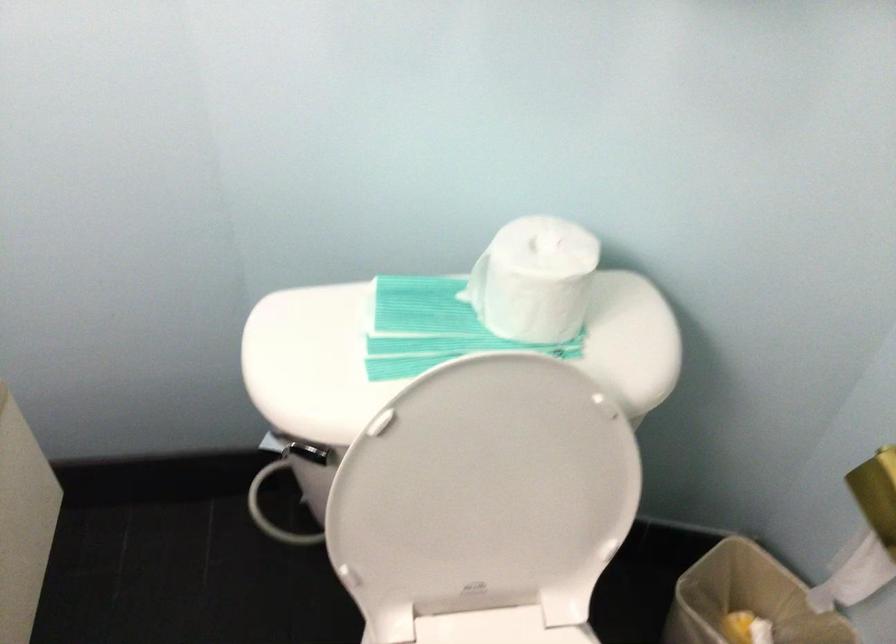
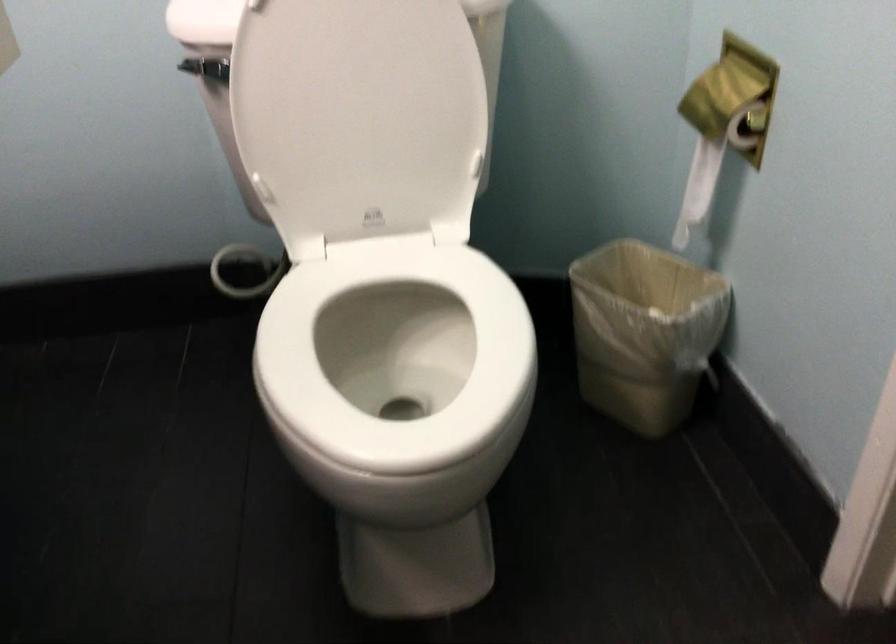
Locate, in the second image, the point that corresponds to pixel 484 518 in the first image.

(359, 114)